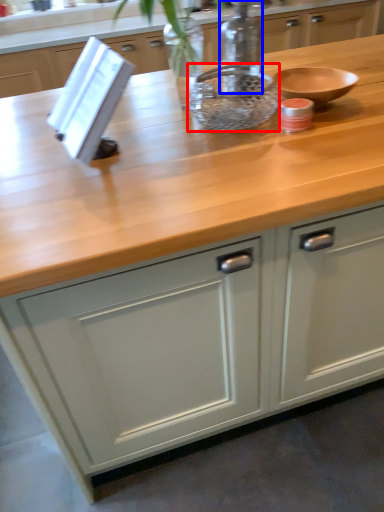
Question: Which object appears farthest to the camera in this image, bowl (highlighted by a red box) or bottle (highlighted by a blue box)?

Choices:
 (A) bowl
 (B) bottle

Answer: (B)